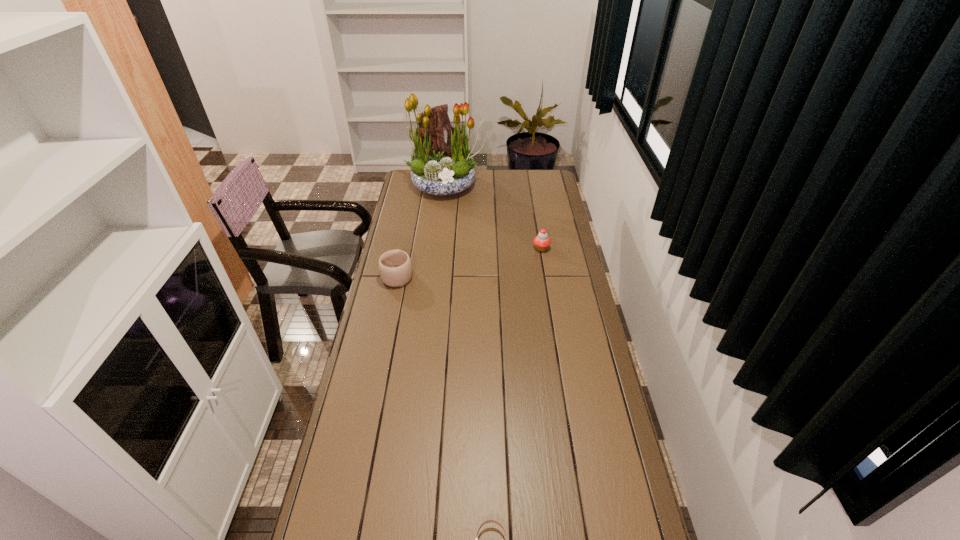
This screenshot has height=540, width=960. I want to click on object that is at the far edge, so click(x=438, y=167).

This screenshot has width=960, height=540. In order to click on flower arrangement that is at the left edge in this screenshot , I will do `click(438, 167)`.

Where is `mug present at the left edge`? mug present at the left edge is located at coordinates (395, 267).

Locate an element on the screen. This screenshot has width=960, height=540. object present at the right edge is located at coordinates (541, 241).

The image size is (960, 540). I want to click on object that is at the far left corner, so (x=438, y=167).

In the image, there is a desktop. Find the location of `free space at the far edge`. free space at the far edge is located at coordinates (503, 187).

Where is `free region at the left edge of the desktop`? This screenshot has height=540, width=960. free region at the left edge of the desktop is located at coordinates (383, 348).

Where is `vacant space at the right edge of the desktop`? This screenshot has width=960, height=540. vacant space at the right edge of the desktop is located at coordinates (617, 423).

This screenshot has height=540, width=960. Find the location of `free spot at the far right corner of the desktop`. free spot at the far right corner of the desktop is located at coordinates (545, 184).

Locate an element on the screen. Image resolution: width=960 pixels, height=540 pixels. vacant space that's between the third farthest object and the flower arrangement is located at coordinates (421, 231).